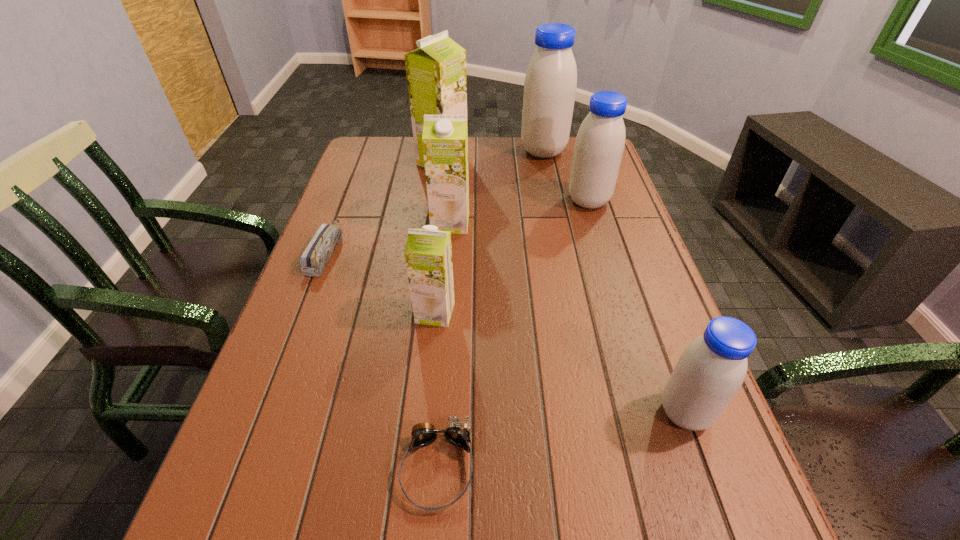
Locate an element on the screen. The width and height of the screenshot is (960, 540). the farthest blue soya milk is located at coordinates (550, 84).

Locate an element on the screen. The height and width of the screenshot is (540, 960). the biggest green soya milk is located at coordinates (436, 72).

You are a GUI agent. You are given a task and a screenshot of the screen. Output one action in this format:
    pyautogui.click(x=<x>, y=<y>)
    Task: Click on the second nearest green soya milk
    This screenshot has width=960, height=540.
    Given the screenshot: What is the action you would take?
    pyautogui.click(x=445, y=137)

The width and height of the screenshot is (960, 540). In order to click on the second biggest blue soya milk in this screenshot , I will do `click(600, 142)`.

Find the location of `the second nearest soya milk`. the second nearest soya milk is located at coordinates (428, 254).

Find the location of a particular element. This screenshot has width=960, height=540. the smallest green soya milk is located at coordinates (428, 254).

The height and width of the screenshot is (540, 960). I want to click on the nearest soya milk, so click(712, 368).

The image size is (960, 540). I want to click on the smallest blue soya milk, so click(712, 368).

The width and height of the screenshot is (960, 540). Find the location of `pencil box`. pencil box is located at coordinates (319, 251).

The image size is (960, 540). In order to click on bronze goggles in this screenshot , I will do `click(457, 433)`.